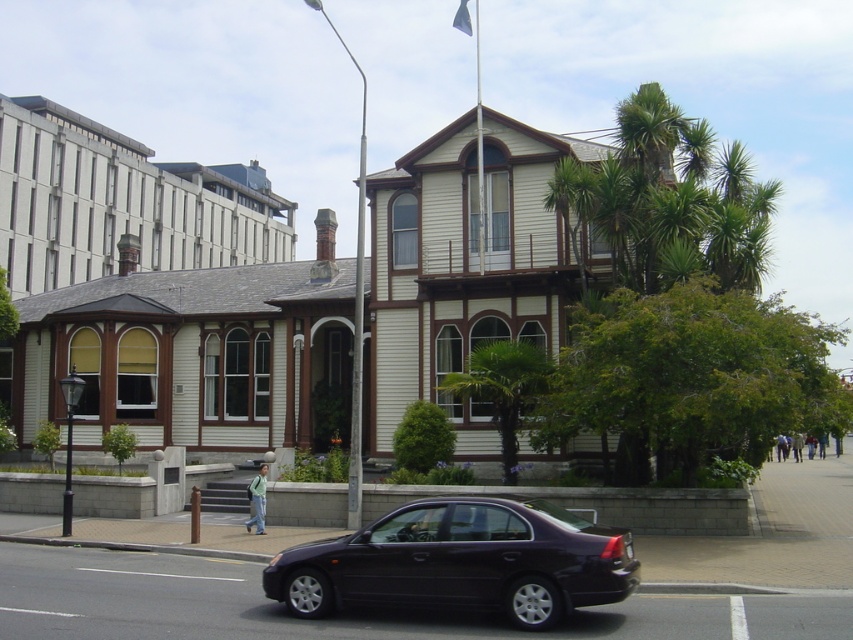
Based on the photo, is satin black sedan at center below green leafy palm tree at center?

Indeed, satin black sedan at center is positioned under green leafy palm tree at center.

Is satin black sedan at center thinner than green leafy palm tree at center?

No.

Locate an element on the screen. satin black sedan at center is located at coordinates (461, 561).

Find the location of a particular element. satin black sedan at center is located at coordinates [x=461, y=561].